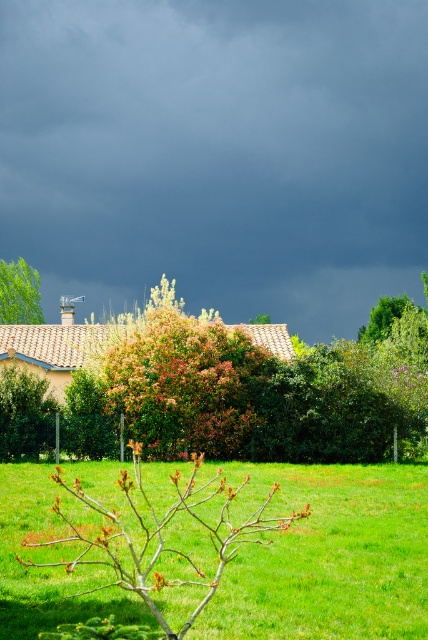
Question: Does green leafy tree at center come in front of green leafy tree at left?

Choices:
 (A) no
 (B) yes

Answer: (B)

Question: Which is farther from the green leafy tree at center?

Choices:
 (A) green leafy tree at left
 (B) green grass at lower center

Answer: (A)

Question: Is green grass at lower center wider than green leafy tree at center?

Choices:
 (A) yes
 (B) no

Answer: (B)

Question: Which is nearer to the green leafy tree at center?

Choices:
 (A) green leafy tree at left
 (B) green grass at lower center
 (C) dark gray cloud at upper center

Answer: (B)

Question: Which of the following is the farthest from the observer?

Choices:
 (A) dark gray cloud at upper center
 (B) green leafy tree at left
 (C) green leafy tree at center
 (D) green grass at lower center

Answer: (A)

Question: Is green leafy tree at center bigger than green leafy tree at left?

Choices:
 (A) no
 (B) yes

Answer: (B)